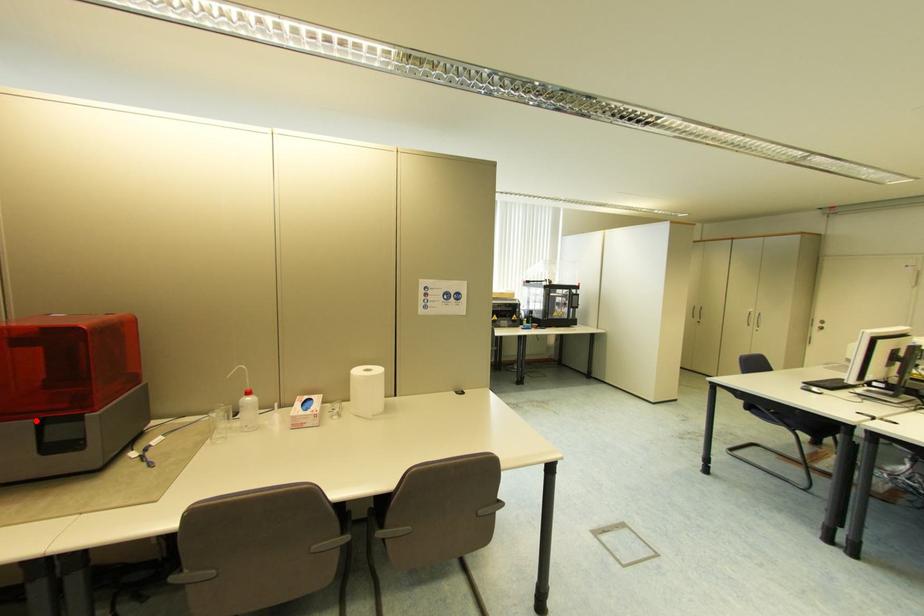
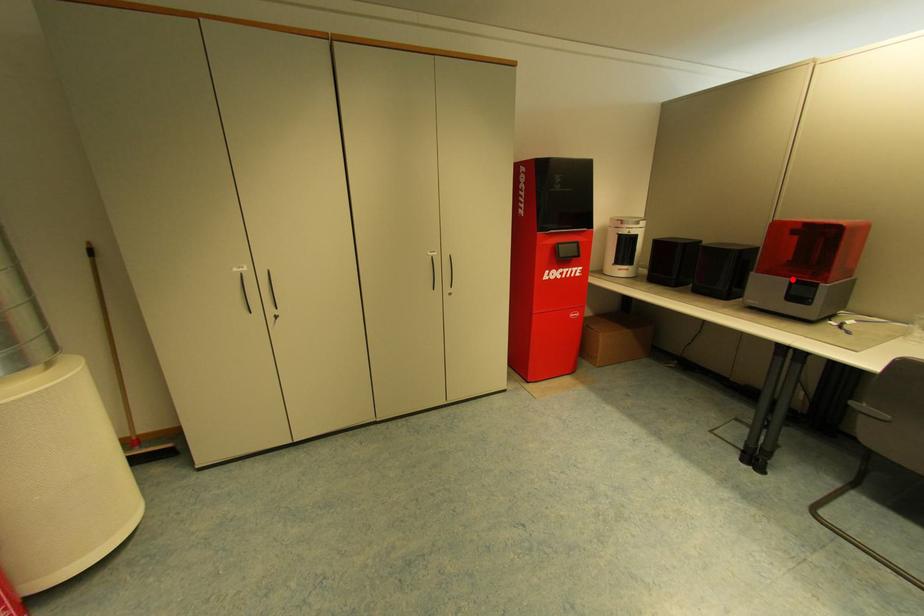
I am providing you with two images of the same scene from different viewpoints. A red point is marked on the first image and another point is marked on the second image. Are the points marked in image1 and image2 representing the same 3D position?

Yes